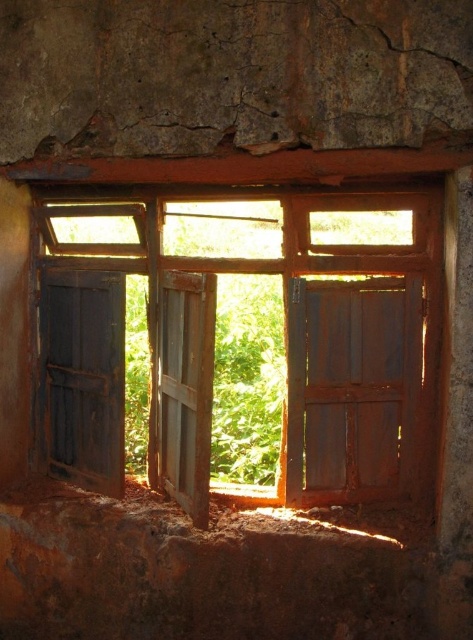
Is rusty wood window at center shorter than weathered wood shutter at center?

Incorrect, rusty wood window at center's height does not fall short of weathered wood shutter at center's.

Does point (210, 378) come behind point (186, 340)?

That is False.

Locate an element on the screen. rusty wood window at center is located at coordinates (250, 340).

Can you confirm if dark wood shutter at left is wider than weathered wood shutter at center?

Yes.

Between dark wood shutter at left and weathered wood shutter at center, which one is positioned lower?

weathered wood shutter at center

What do you see at coordinates (84, 376) in the screenshot? This screenshot has width=473, height=640. I see `dark wood shutter at left` at bounding box center [84, 376].

At what (x,y) coordinates should I click in order to perform the action: click on dark wood shutter at left. Please return your answer as a coordinate pair (x, y). The height and width of the screenshot is (640, 473). Looking at the image, I should click on (84, 376).

Is rusty wood window at center in front of dark wood shutter at left?

Yes, it is.

Does rusty wood window at center appear on the right side of dark wood shutter at left?

Correct, you'll find rusty wood window at center to the right of dark wood shutter at left.

Between point (237, 490) and point (110, 275), which one is positioned in front?

Point (110, 275)

Where is `rusty wood window at center`? Image resolution: width=473 pixels, height=640 pixels. rusty wood window at center is located at coordinates (250, 340).